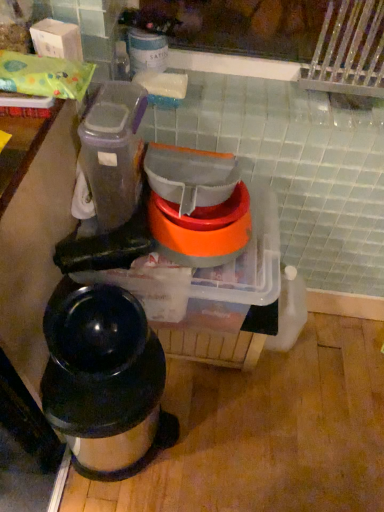
I want to click on vacant area that is situated to the right of shiny black thermos at lower left, so click(219, 435).